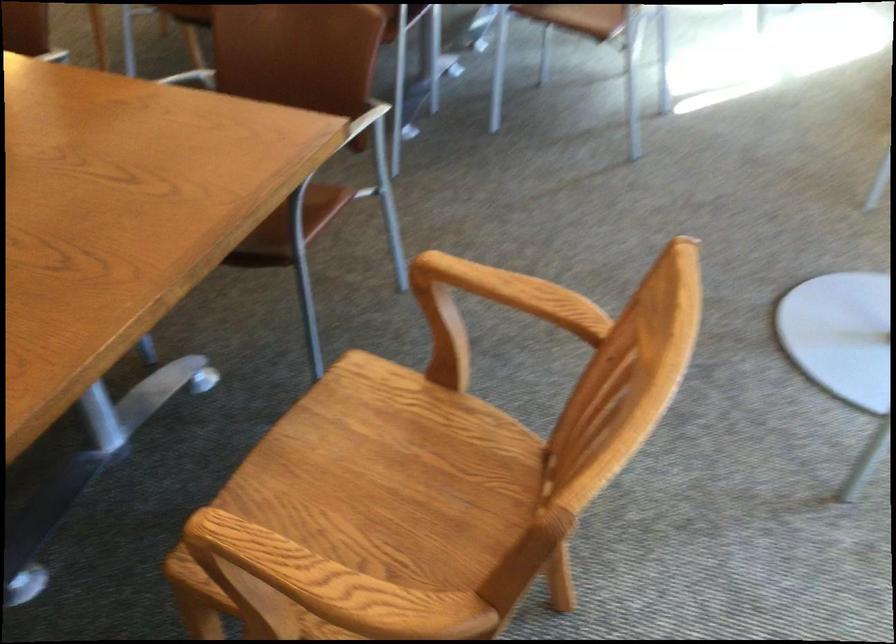
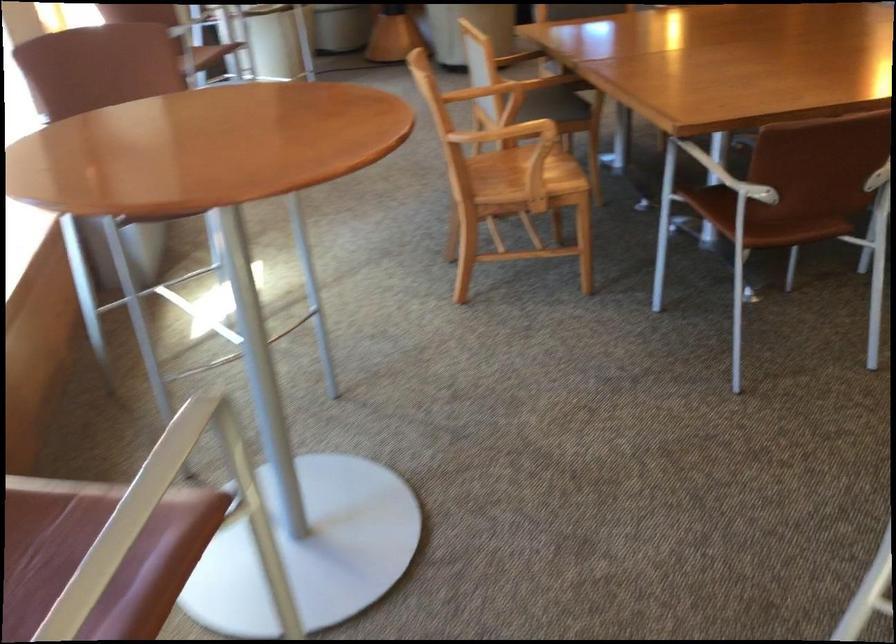
Question: I am providing you with two images of the same scene from different viewpoints. After the viewpoint changes to image2, which objects are now occluded?

Choices:
 (A) wooden chair sitting surface
 (B) brown chair sitting surface
 (C) white chair armrest
 (D) orange mug handle

Answer: (B)